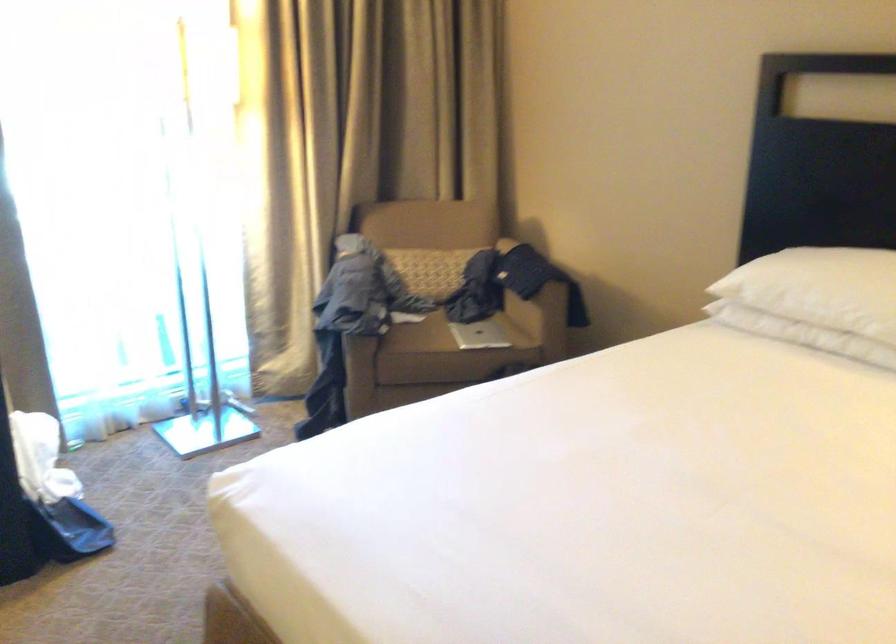
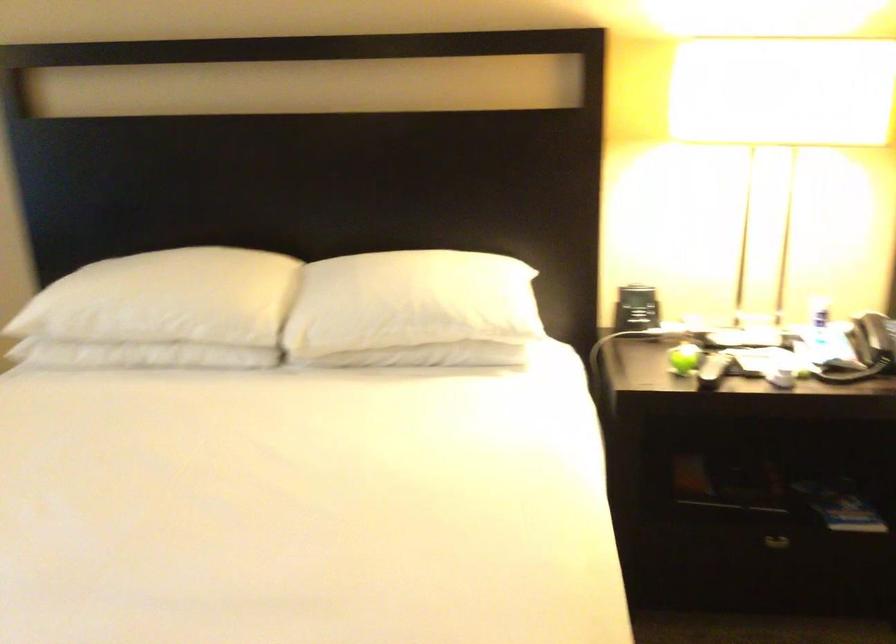
Question: The images are taken continuously from a first-person perspective. In which direction is your viewpoint rotating?

Choices:
 (A) Left
 (B) Right
 (C) Up
 (D) Down

Answer: (B)